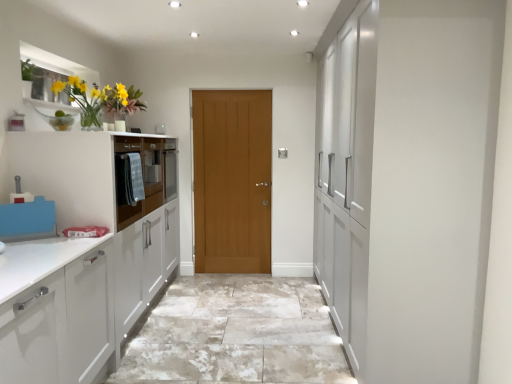
Question: Is point (186, 334) positioned closer to the camera than point (217, 139)?

Choices:
 (A) closer
 (B) farther

Answer: (A)

Question: Which is correct: natural stone floor at center is inside light brown wooden door at center, or outside of it?

Choices:
 (A) inside
 (B) outside

Answer: (B)

Question: Considering the real-world distances, which object is closest to the natural stone floor at center?

Choices:
 (A) matte glass vase at upper left
 (B) light brown wooden door at center
 (C) matte gray oven at left

Answer: (C)

Question: Which is nearer to the matte glass vase at upper left?

Choices:
 (A) natural stone floor at center
 (B) matte gray oven at left
 (C) light brown wooden door at center

Answer: (B)